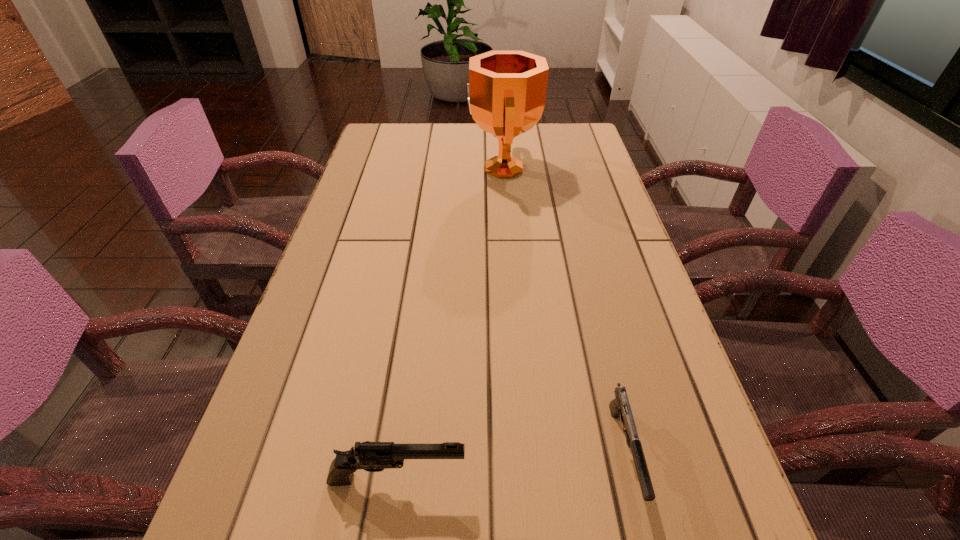
Locate an element on the screen. The width and height of the screenshot is (960, 540). free space that satisfies the following two spatial constraints: 1. at the muzzle end of the right gun; 2. at the end of the barrel of the taller gun is located at coordinates (631, 478).

Locate an element on the screen. The width and height of the screenshot is (960, 540). free space that satisfies the following two spatial constraints: 1. at the muzzle end of the shorter gun; 2. at the end of the barrel of the left gun is located at coordinates (631, 478).